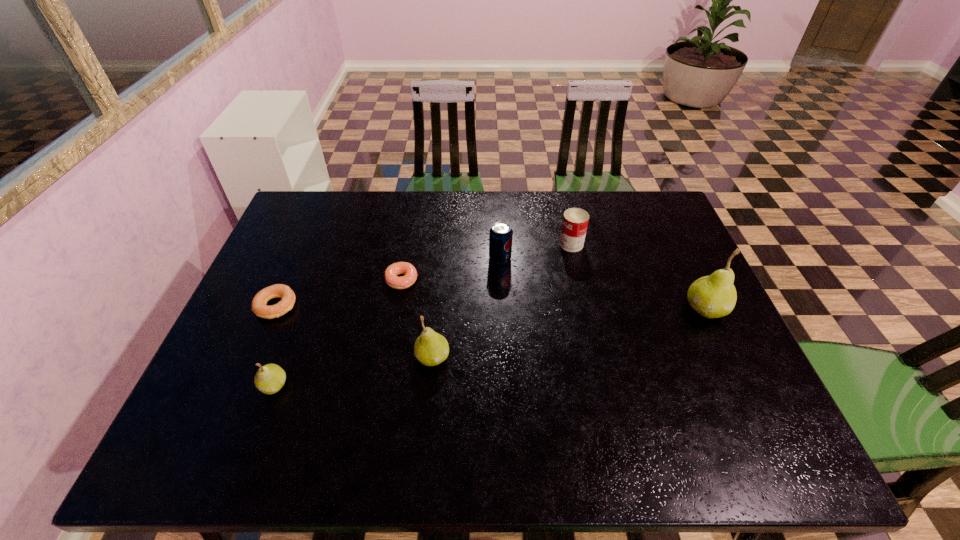
Identify the location of vacant region located 0.370m on the back of the nearest object. Image resolution: width=960 pixels, height=540 pixels. (319, 265).

You are a GUI agent. You are given a task and a screenshot of the screen. Output one action in this format:
    pyautogui.click(x=<x>, y=<y>)
    Task: Click on the vacant space located on the left of the second tallest pear
    
    Given the screenshot: What is the action you would take?
    pyautogui.click(x=349, y=357)

I want to click on free space located on the back of the rightmost object, so click(x=686, y=267).

At what (x,y) coordinates should I click in order to perform the action: click on blank area located on the front label of the can. Please return your answer as a coordinate pair (x, y). Image resolution: width=960 pixels, height=540 pixels. Looking at the image, I should click on (514, 244).

Identify the location of vacant space located 0.070m on the front label of the can. (537, 244).

Locate an element on the screen. This screenshot has height=540, width=960. free region located 0.380m on the front label of the can is located at coordinates (437, 244).

Locate an element on the screen. This screenshot has height=540, width=960. free spot located 0.370m on the back of the bagel is located at coordinates (318, 211).

Image resolution: width=960 pixels, height=540 pixels. In order to click on vacant space positioned 0.080m on the front of the doughnut in this screenshot , I will do `click(396, 314)`.

I want to click on vacant area located 0.380m on the right of the soda can, so click(638, 259).

Where is `object present at the near edge`? The height and width of the screenshot is (540, 960). object present at the near edge is located at coordinates (270, 378).